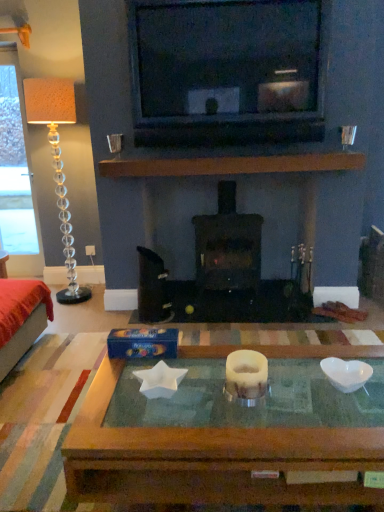
Find the location of a particular element. vacant space in front of translucent glass floor lamp at left is located at coordinates (77, 314).